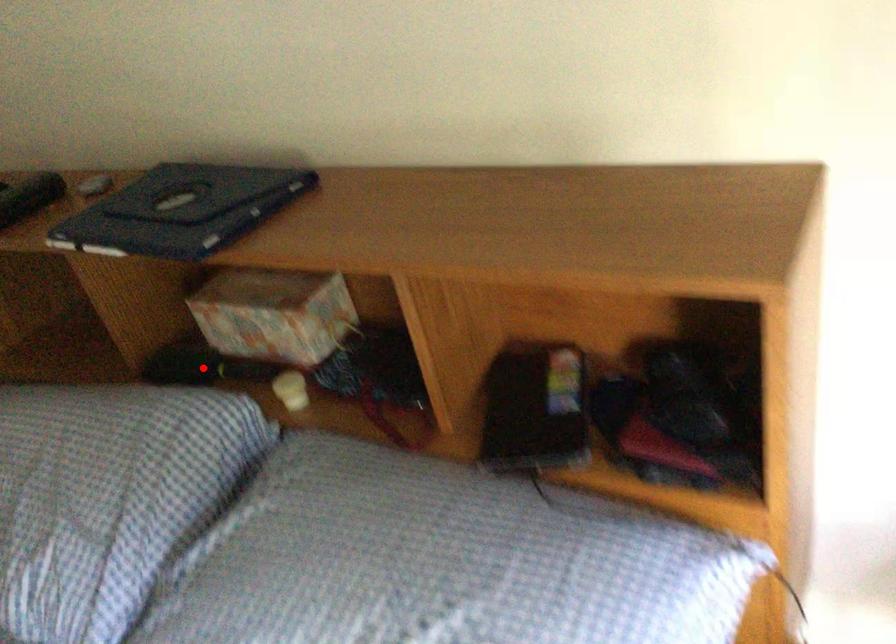
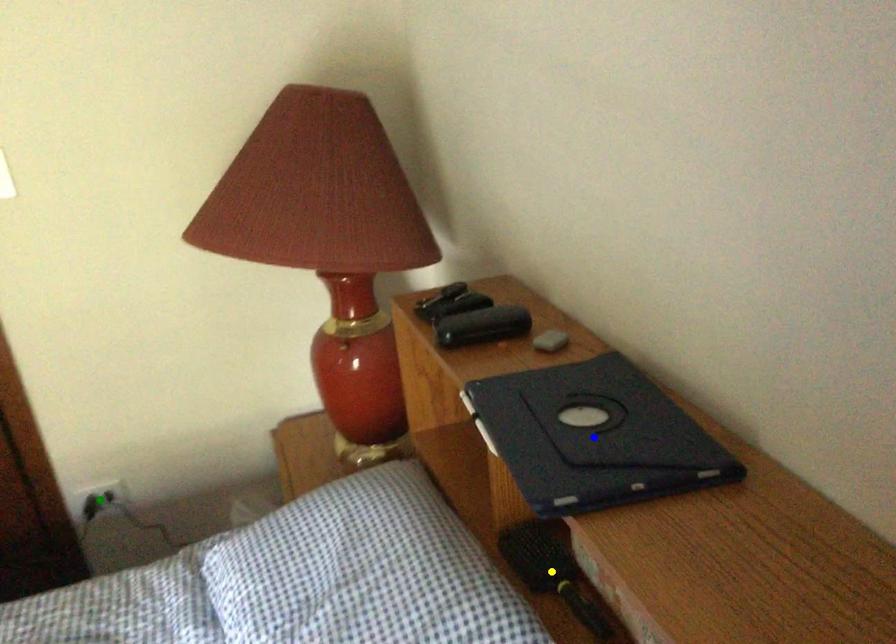
Question: I am providing you with two images of the same scene from different viewpoints. A red point is marked on the first image. You are given multiple points on the second image. In image 2, which mark is for the same physical point as the one in image 1?

Choices:
 (A) green point
 (B) blue point
 (C) yellow point

Answer: (C)